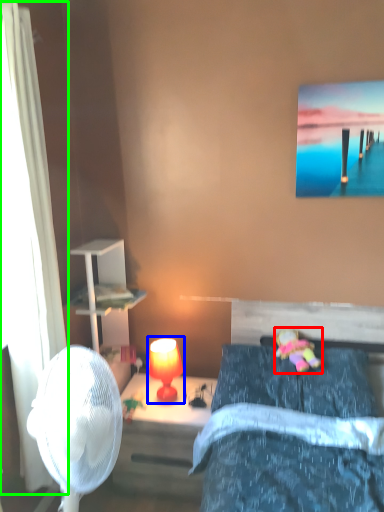
Question: Considering the real-world distances, which object is closest to toy (highlighted by a red box)? table lamp (highlighted by a blue box) or curtain (highlighted by a green box).

Choices:
 (A) table lamp
 (B) curtain

Answer: (A)